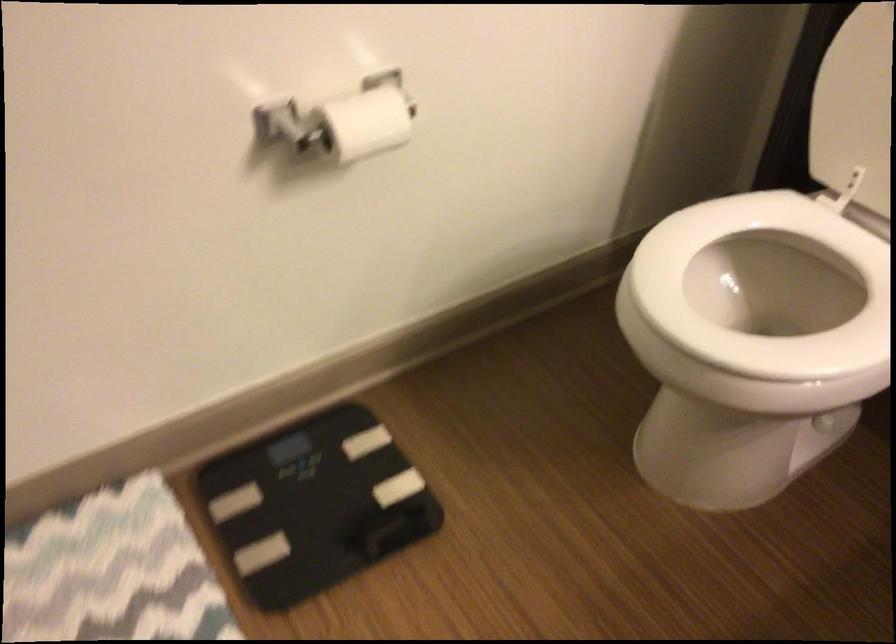
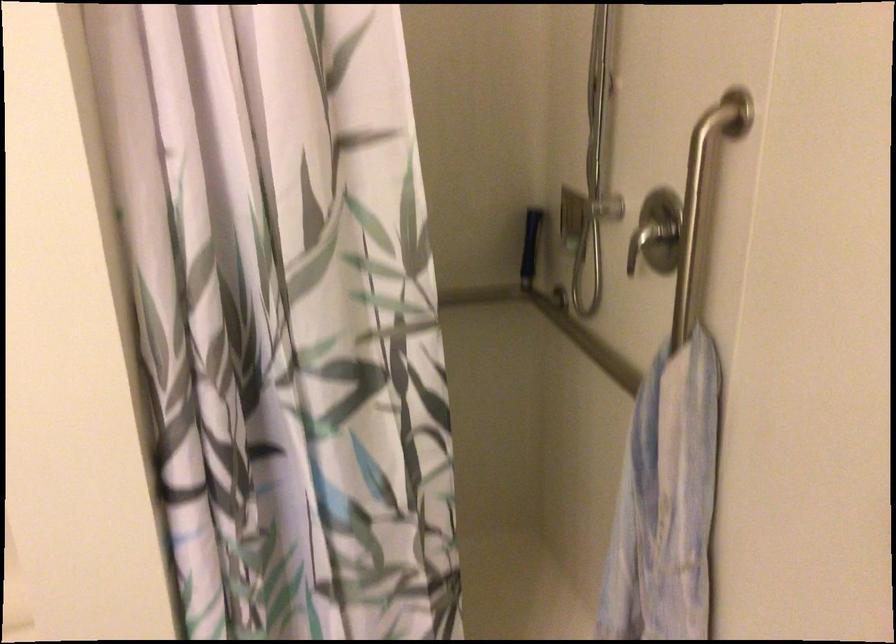
How did the camera likely rotate?

The camera's rotation is toward left-down.